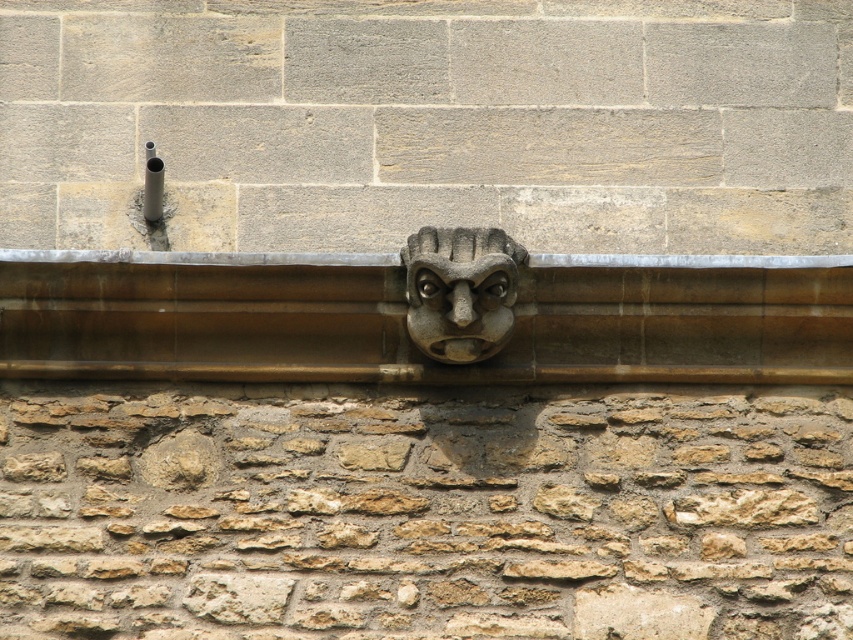
You are a stonemason working on the wall and need to place a decorative stone piece. You have two options from the image, the brown rough stone at center and the brown stone ledge at center. Which one should you choose if you need a larger piece for your project?

The brown rough stone at center has a larger size compared to the brown stone ledge at center, so you should choose the brown rough stone at center for your project.

From the picture: You are a small bird looking for a place to perch. You see the brown stone ledge at center and the stone carved face at center. Which one is taller and would provide a higher spot to sit?

The brown stone ledge at center is taller than the stone carved face at center, so it would provide a higher spot for the bird to perch.

Based on the photo, you are standing in front of the stone wall with the carved gargoyle. You notice two points marked on the wall at coordinates point [271,632] and point [850,278]. Which point is closer to you?

Point [271,632] is closer to the camera than point [850,278], so the point closer to you is point [271,632].